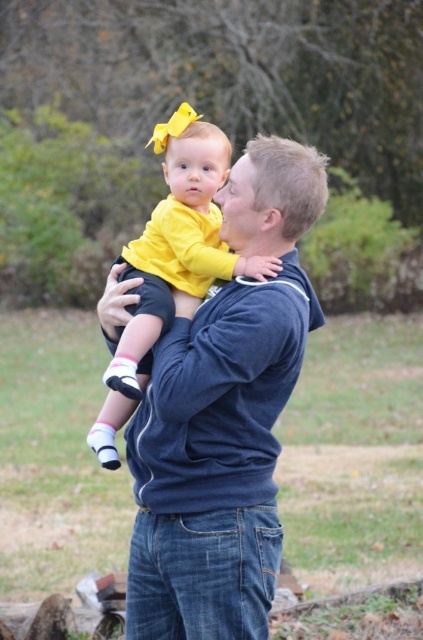
Between blue cotton hoodie at center and yellow matte shirt at center, which one is positioned higher?

yellow matte shirt at center is higher up.

How far apart are blue cotton hoodie at center and yellow matte shirt at center?

The distance of blue cotton hoodie at center from yellow matte shirt at center is 13.74 inches.

Is point (118, 292) behind point (175, 115)?

No, (118, 292) is in front of (175, 115).

You are a GUI agent. You are given a task and a screenshot of the screen. Output one action in this format:
    pyautogui.click(x=<x>, y=<y>)
    Task: Click on the blue cotton hoodie at center
    
    Given the screenshot: What is the action you would take?
    click(x=224, y=419)